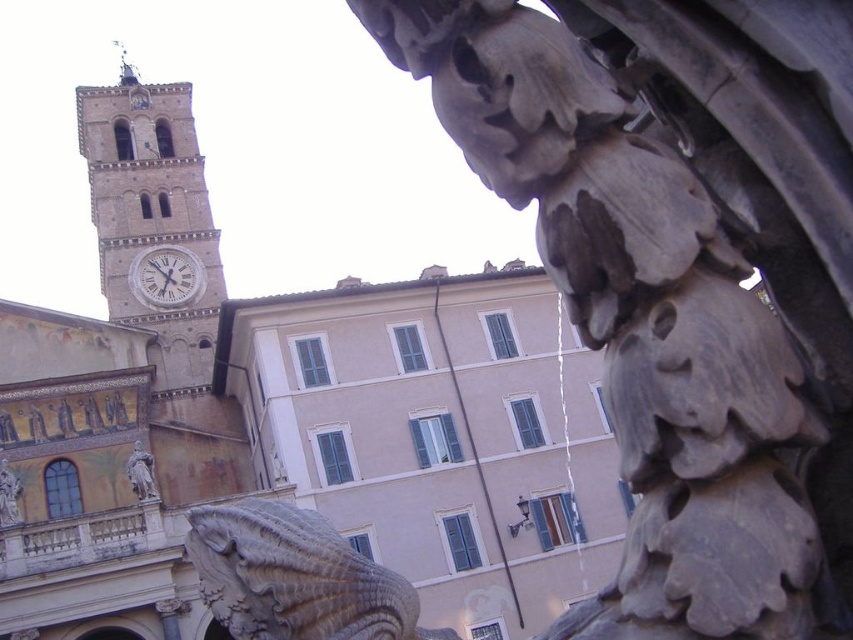
You are standing in the urban scene and want to take a photo of both the brown stone clock tower at upper left and the polished bronze statue at center. Which object should you adjust your camera focus on first to ensure it appears sharp in the photo?

The brown stone clock tower at upper left is closer to you than the polished bronze statue at center, so you should focus on the brown stone clock tower at upper left first to ensure both are in focus.